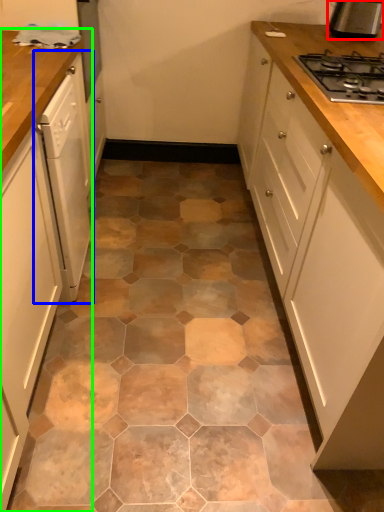
Question: Considering the real-world distances, which object is farthest from kitchen appliance (highlighted by a red box)? home appliance (highlighted by a blue box) or cabinetry (highlighted by a green box)?

Choices:
 (A) home appliance
 (B) cabinetry

Answer: (B)